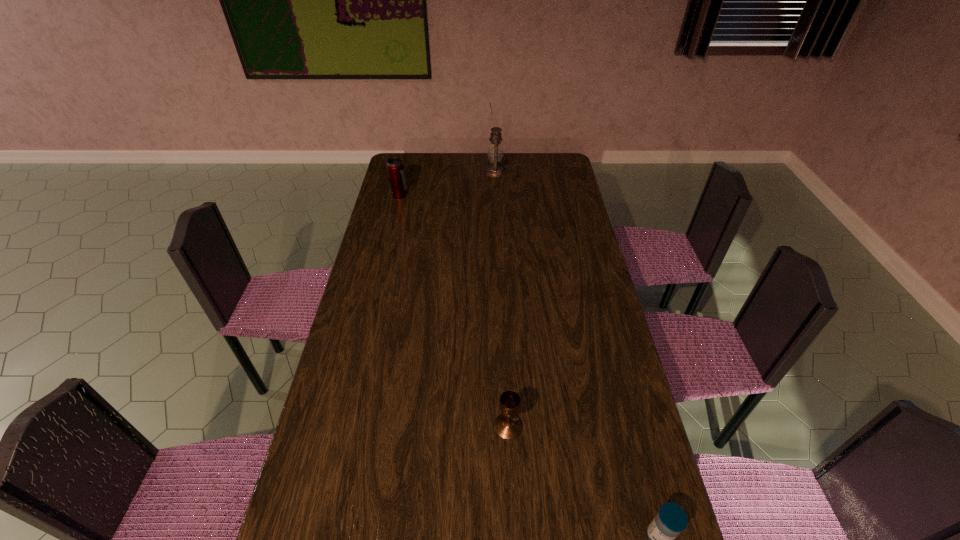
You are a GUI agent. You are given a task and a screenshot of the screen. Output one action in this format:
    pyautogui.click(x=<x>, y=<y>)
    Task: Click on the vacant region between the third nearest object and the second nearest object
    The width and height of the screenshot is (960, 540).
    Given the screenshot: What is the action you would take?
    pyautogui.click(x=454, y=311)

Locate which object ranks third in proximity to the second nearest object. Please provide its 2D coordinates. Your answer should be formatted as a tuple, i.e. [(x, y)], where the tuple contains the x and y coordinates of a point satisfying the conditions above.

[(495, 153)]

Identify which object is located as the second nearest to the medicine. Please provide its 2D coordinates. Your answer should be formatted as a tuple, i.e. [(x, y)], where the tuple contains the x and y coordinates of a point satisfying the conditions above.

[(395, 167)]

This screenshot has height=540, width=960. In order to click on vacant space that satisfies the following two spatial constraints: 1. on the back side of the chalice; 2. on the side with the handle of the third nearest object in this screenshot , I will do `click(496, 195)`.

Where is `blank space that satisfies the following two spatial constraints: 1. on the side with the handle of the second nearest object; 2. on the right side of the leftmost object`? blank space that satisfies the following two spatial constraints: 1. on the side with the handle of the second nearest object; 2. on the right side of the leftmost object is located at coordinates (347, 427).

Locate an element on the screen. The image size is (960, 540). vacant area in the image that satisfies the following two spatial constraints: 1. on the side with the handle of the chalice; 2. on the right side of the leftmost object is located at coordinates (347, 427).